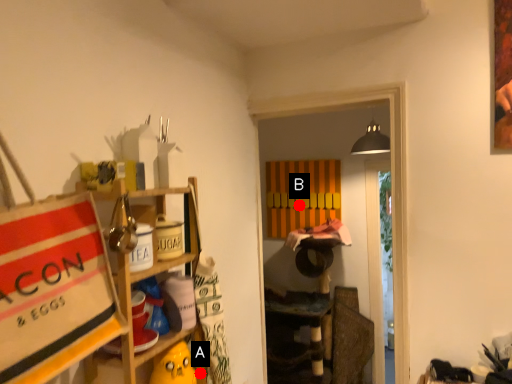
Question: Two points are circled on the image, labeled by A and B beside each circle. Which point appears farthest from the camera in this image?

Choices:
 (A) A is further
 (B) B is further

Answer: (B)